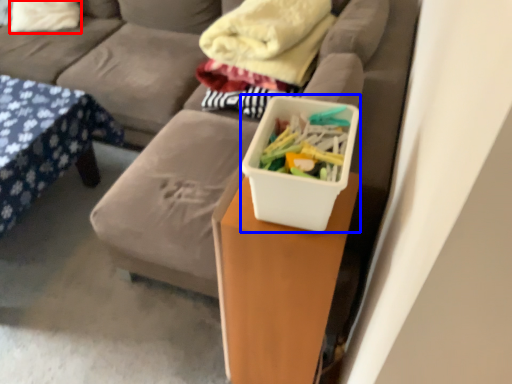
Question: Among these objects, which one is nearest to the camera, pillow (highlighted by a red box) or storage box (highlighted by a blue box)?

Choices:
 (A) pillow
 (B) storage box

Answer: (B)